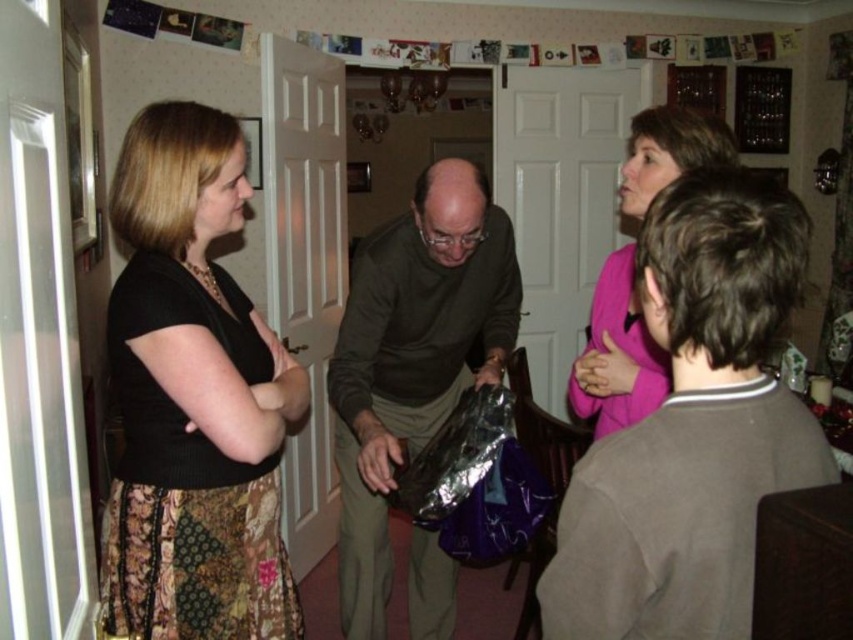
Question: Is black textured sweater at left to the right of pink matte sweater at upper right from the viewer's perspective?

Choices:
 (A) no
 (B) yes

Answer: (A)

Question: Can you confirm if black textured sweater at left is wider than pink matte sweater at upper right?

Choices:
 (A) no
 (B) yes

Answer: (B)

Question: Can you confirm if black textured sweater at left is positioned above pink matte sweater at upper right?

Choices:
 (A) no
 (B) yes

Answer: (A)

Question: Among these points, which one is nearest to the camera?

Choices:
 (A) (170, 371)
 (B) (384, 465)

Answer: (A)

Question: Among these objects, which one is nearest to the camera?

Choices:
 (A) matte green sweater at center
 (B) pink matte sweater at upper right

Answer: (B)

Question: Which object appears closest to the camera in this image?

Choices:
 (A) matte green sweater at center
 (B) pink matte sweater at upper right
 (C) black textured sweater at left

Answer: (C)